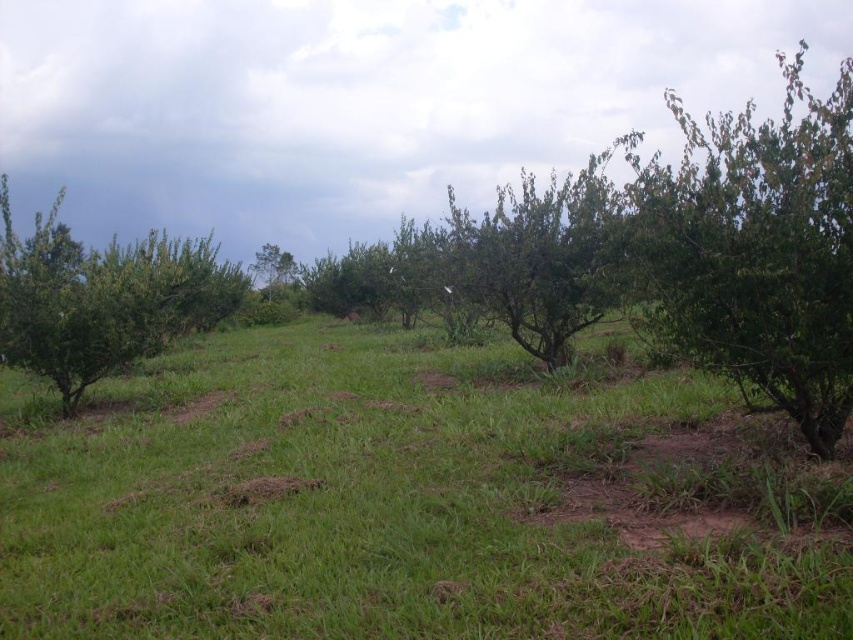
Which is in front, point (711, 163) or point (16, 276)?

Point (711, 163) is in front.

Is green leafy tree at right thinner than green leafy tree at left?

No, green leafy tree at right is not thinner than green leafy tree at left.

This screenshot has width=853, height=640. I want to click on green leafy tree at right, so click(x=757, y=248).

Describe the element at coordinates (408, 500) in the screenshot. I see `green grassy at center` at that location.

Image resolution: width=853 pixels, height=640 pixels. What do you see at coordinates (408, 500) in the screenshot? I see `green grassy at center` at bounding box center [408, 500].

Where is `green grassy at center`? This screenshot has width=853, height=640. green grassy at center is located at coordinates (408, 500).

Which of these two, green grassy at center or green leafy tree at left, stands shorter?

With less height is green grassy at center.

How far apart are green grassy at center and green leafy tree at left?

green grassy at center and green leafy tree at left are 8.38 meters apart from each other.

Is point (305, 628) behind point (50, 280)?

No, (305, 628) is in front of (50, 280).

The width and height of the screenshot is (853, 640). In order to click on green grassy at center in this screenshot , I will do `click(408, 500)`.